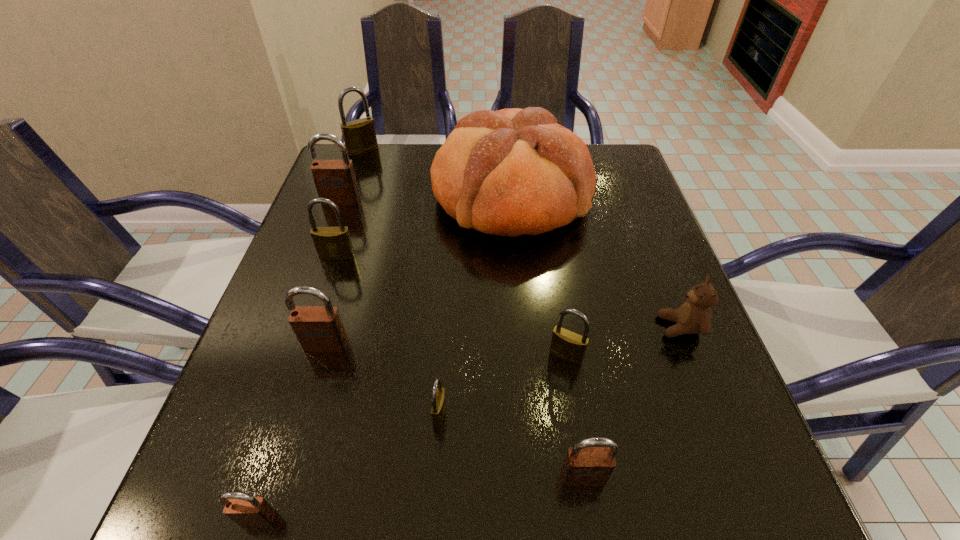
The width and height of the screenshot is (960, 540). I want to click on teddy bear at the right edge, so click(694, 316).

Find the location of a particular element. The height and width of the screenshot is (540, 960). object that is at the far left corner is located at coordinates (359, 135).

You are a GUI agent. You are given a task and a screenshot of the screen. Output one action in this format:
    pyautogui.click(x=<x>, y=<y>)
    Task: Click on the object that is at the near left corner
    This screenshot has width=960, height=540.
    Given the screenshot: What is the action you would take?
    pyautogui.click(x=244, y=509)

At what (x,y) coordinates should I click in order to perform the action: click on object situated at the far right corner. Please return your answer as a coordinate pair (x, y). This screenshot has height=540, width=960. Looking at the image, I should click on (510, 172).

At what (x,y) coordinates should I click in order to perform the action: click on vacant space at the far edge. Please return your answer as a coordinate pair (x, y). The height and width of the screenshot is (540, 960). Looking at the image, I should click on (396, 147).

The height and width of the screenshot is (540, 960). I want to click on vacant space at the near edge of the desktop, so click(x=641, y=468).

Identify the location of free region at the left edge of the desktop. This screenshot has height=540, width=960. (303, 363).

Identify the location of free region at the right edge. (657, 280).

Identify the location of unoccupied position between the rightmost brass padlock and the rightmost brown padlock. This screenshot has height=540, width=960. (575, 416).

What are the coordinates of `vacant space that is in between the biggest brass padlock and the third brass padlock from left to right` in the screenshot? It's located at (401, 282).